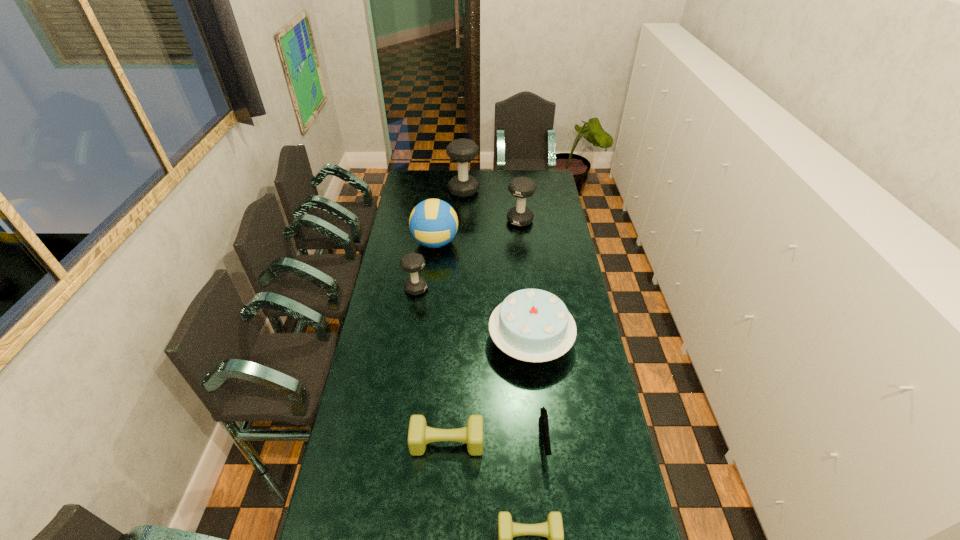
Where is `the tallest dumbbell`? the tallest dumbbell is located at coordinates (462, 150).

You are a GUI agent. You are given a task and a screenshot of the screen. Output one action in this format:
    pyautogui.click(x=<x>, y=<y>)
    Task: Click on the farthest object
    The height and width of the screenshot is (540, 960).
    Given the screenshot: What is the action you would take?
    pyautogui.click(x=462, y=150)

Where is `blue volleyball`? This screenshot has width=960, height=540. blue volleyball is located at coordinates (433, 223).

Find the location of `the second smallest gray dumbbell`. the second smallest gray dumbbell is located at coordinates (521, 187).

This screenshot has width=960, height=540. Identify the location of the second tallest dumbbell. (521, 187).

Find the location of a particular element. This screenshot has height=540, width=960. the fifth farthest object is located at coordinates (533, 325).

Where is `birthday cake`? Image resolution: width=960 pixels, height=540 pixels. birthday cake is located at coordinates (533, 325).

You are a GUI agent. You are given a task and a screenshot of the screen. Output one action in this format:
    pyautogui.click(x=<x>, y=<y>)
    Task: Click on the fifth nearest object
    
    Given the screenshot: What is the action you would take?
    pyautogui.click(x=412, y=262)

Find the location of a particular element. the leftmost gray dumbbell is located at coordinates (412, 262).

Identify the location of the left olive dumbbell. (419, 434).